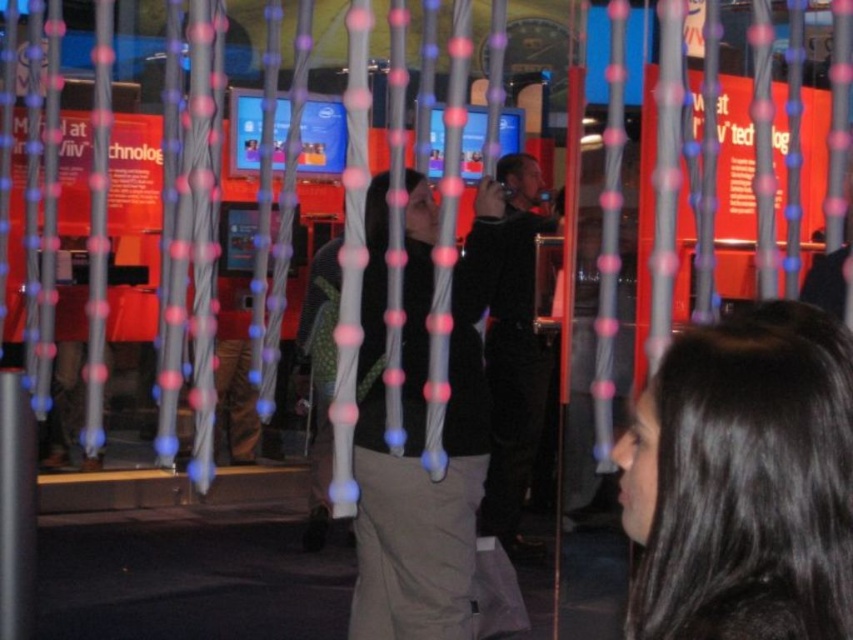
Question: Among these points, which one is nearest to the camera?

Choices:
 (A) (801, 448)
 (B) (492, 516)

Answer: (A)

Question: Among these points, which one is farthest from the camera?

Choices:
 (A) (523, 172)
 (B) (757, 396)

Answer: (A)

Question: Is black hair at upper right positioned before dark blue fabric jacket at center?

Choices:
 (A) no
 (B) yes

Answer: (B)

Question: Is black hair at upper right positioned behind dark blue fabric jacket at center?

Choices:
 (A) no
 (B) yes

Answer: (A)

Question: Considering the relative positions of black hair at upper right and dark blue fabric jacket at center in the image provided, where is black hair at upper right located with respect to dark blue fabric jacket at center?

Choices:
 (A) below
 (B) above

Answer: (A)